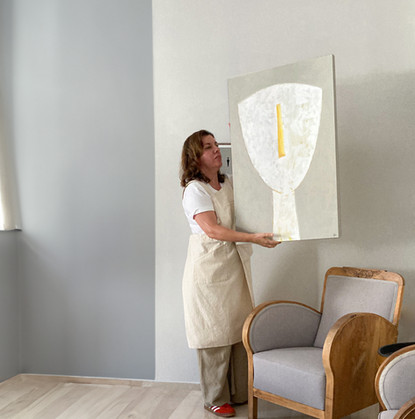
At what (x,y) coordinates should I click in order to perform the action: click on shadow from painting. Please return your answer as a coordinate pair (x, y). Looking at the image, I should click on (373, 142).